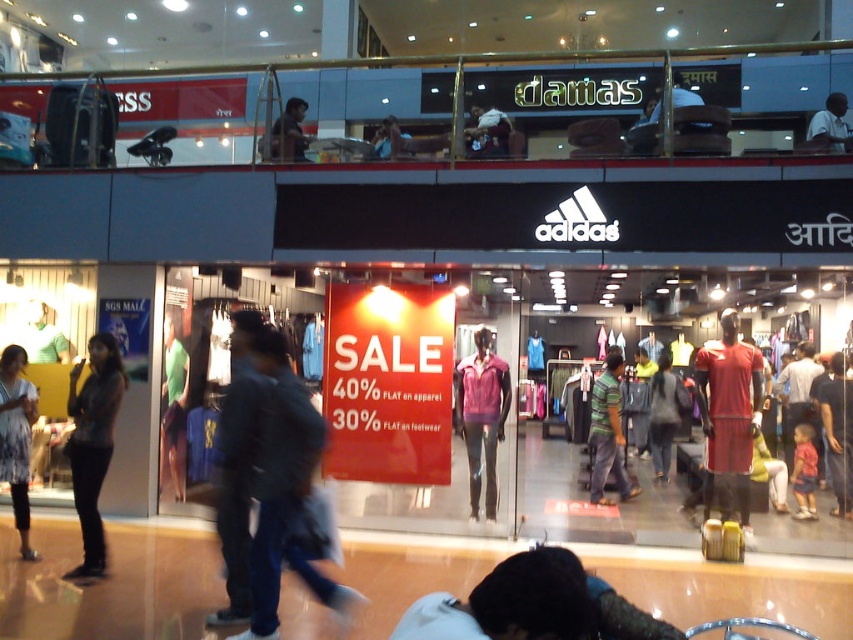
Question: Which of the following is the closest to the observer?

Choices:
 (A) green fabric shorts at center
 (B) light blue shirt at upper right

Answer: (B)

Question: From the image, what is the correct spatial relationship of printed cotton dress at lower left in relation to light blue shirt at upper right?

Choices:
 (A) left
 (B) right

Answer: (A)

Question: Which point is farther from the camera taking this photo?

Choices:
 (A) (842, 113)
 (B) (288, 148)
 (C) (80, 477)

Answer: (B)

Question: Which point appears farthest from the camera in this image?

Choices:
 (A) (164, 474)
 (B) (598, 496)
 (C) (723, 392)

Answer: (B)

Question: Can you confirm if denim jacket at center is positioned above striped cotton shirt at center?

Choices:
 (A) yes
 (B) no

Answer: (A)

Question: Does striped cotton shirt at center appear under matte red shirt at center?

Choices:
 (A) no
 (B) yes

Answer: (B)